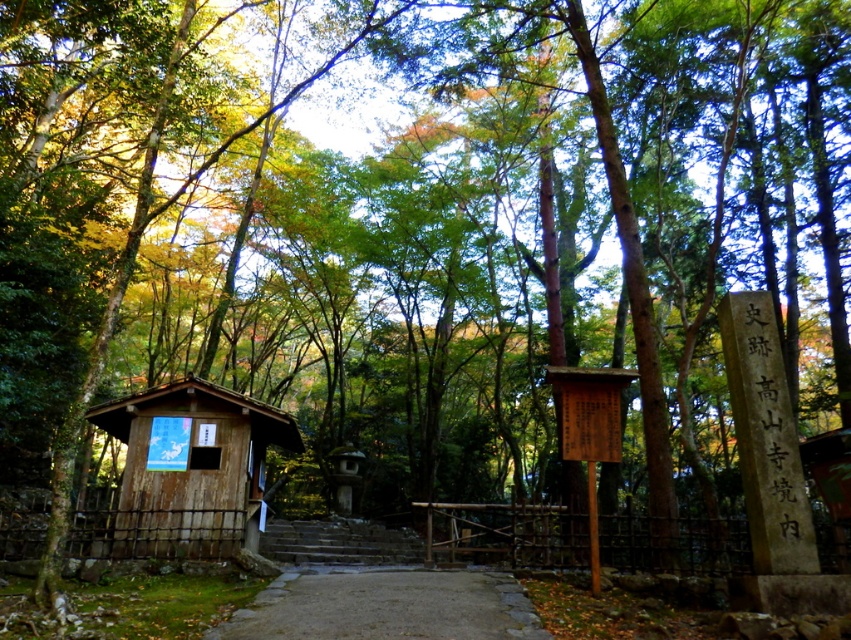
Who is taller, smooth stone path at center or stone steps at center?

smooth stone path at center is taller.

Can you confirm if smooth stone path at center is positioned below stone steps at center?

No, smooth stone path at center is not below stone steps at center.

Between point (478, 596) and point (360, 541), which one is positioned in front?

Positioned in front is point (478, 596).

Where is `smooth stone path at center`? The height and width of the screenshot is (640, 851). smooth stone path at center is located at coordinates point(386,605).

Is wooden hut at center below stone steps at center?

No.

Does wooden hut at center have a lesser height compared to stone steps at center?

No.

Does point (178, 410) lie in front of point (363, 540)?

Yes, point (178, 410) is in front of point (363, 540).

At what (x,y) coordinates should I click in order to perform the action: click on wooden hut at center. Please return your answer as a coordinate pair (x, y). This screenshot has height=640, width=851. Looking at the image, I should click on (191, 467).

Does wooden hut at center appear on the right side of smooth stone path at center?

In fact, wooden hut at center is to the left of smooth stone path at center.

Does wooden hut at center have a larger size compared to smooth stone path at center?

Correct, wooden hut at center is larger in size than smooth stone path at center.

Locate an element on the screen. The image size is (851, 640). wooden hut at center is located at coordinates (191, 467).